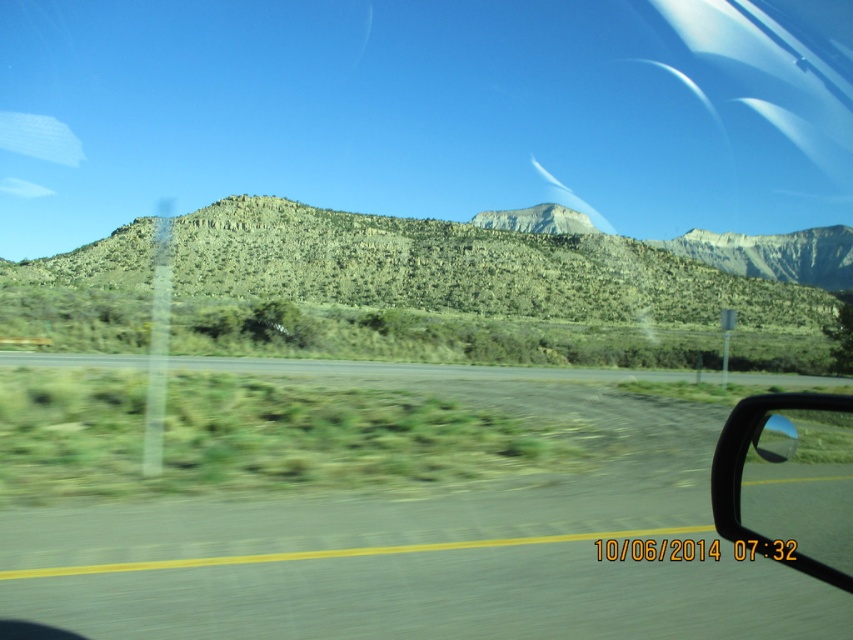
How far apart are black rubber view mirror at lower right and green grassy highway at center?

black rubber view mirror at lower right and green grassy highway at center are 9.82 meters apart.

Who is positioned more to the left, black rubber view mirror at lower right or green grassy highway at center?

Positioned to the left is green grassy highway at center.

Is point (762, 506) farther from viewer compared to point (750, 378)?

No, (762, 506) is closer to viewer.

Identify the location of black rubber view mirror at lower right. 788,481.

In the scene shown: Is green textured hill at center smaller than black rubber view mirror at lower right?

No, green textured hill at center is not smaller than black rubber view mirror at lower right.

At what (x,y) coordinates should I click in order to perform the action: click on green textured hill at center. Please return your answer as a coordinate pair (x, y). Looking at the image, I should click on (465, 268).

You are a GUI agent. You are given a task and a screenshot of the screen. Output one action in this format:
    pyautogui.click(x=<x>, y=<y>)
    Task: Click on the green textured hill at center
    Image resolution: width=853 pixels, height=640 pixels.
    Given the screenshot: What is the action you would take?
    pyautogui.click(x=465, y=268)

Who is higher up, green textured hill at center or green grassy highway at center?

Positioned higher is green textured hill at center.

Is green textured hill at center shorter than green grassy highway at center?

No, green textured hill at center is not shorter than green grassy highway at center.

Is point (364, 244) farther from viewer compared to point (119, 358)?

Yes, point (364, 244) is farther from viewer.

At what (x,y) coordinates should I click in order to perform the action: click on green textured hill at center. Please return your answer as a coordinate pair (x, y). This screenshot has width=853, height=640. Looking at the image, I should click on (465, 268).